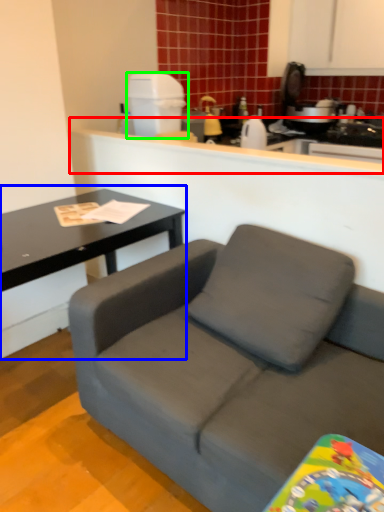
Question: Which object is the closest to the counter (highlighted by a red box)? Choose among these: coffee table (highlighted by a blue box) or appliance (highlighted by a green box).

Choices:
 (A) coffee table
 (B) appliance

Answer: (B)